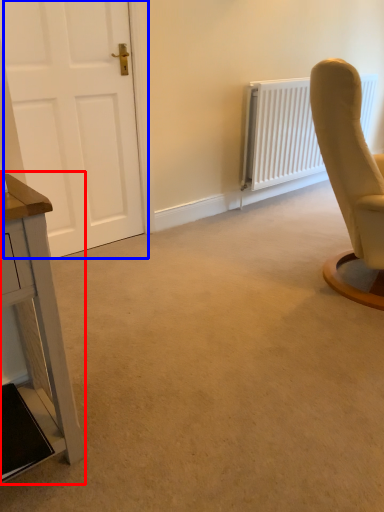
Question: Among these objects, which one is nearest to the camera, table (highlighted by a red box) or door (highlighted by a blue box)?

Choices:
 (A) table
 (B) door

Answer: (A)